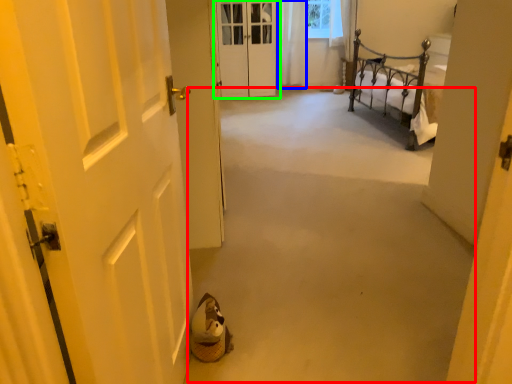
Question: Which object is the closest to the corridor (highlighted by a red box)? Choose among these: curtain (highlighted by a blue box) or door (highlighted by a green box).

Choices:
 (A) curtain
 (B) door

Answer: (B)